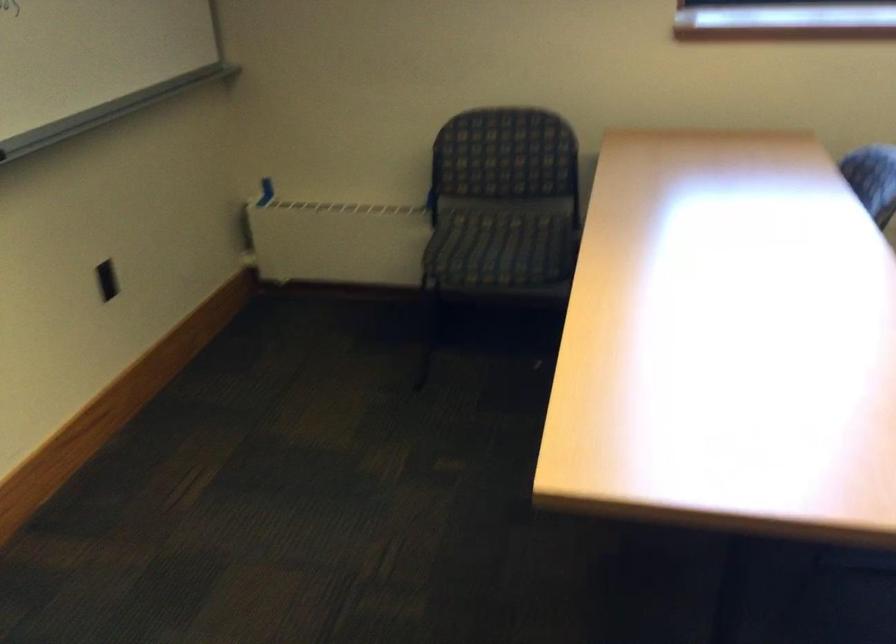
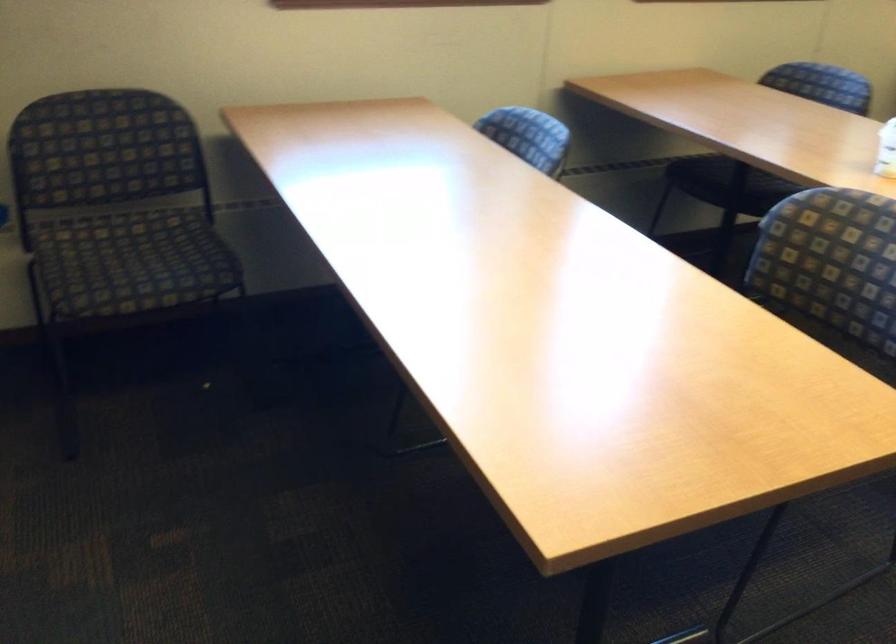
Question: The first image is from the beginning of the video and the second image is from the end. How did the camera likely rotate when shooting the video?

Choices:
 (A) Left
 (B) Right
 (C) Up
 (D) Down

Answer: (B)